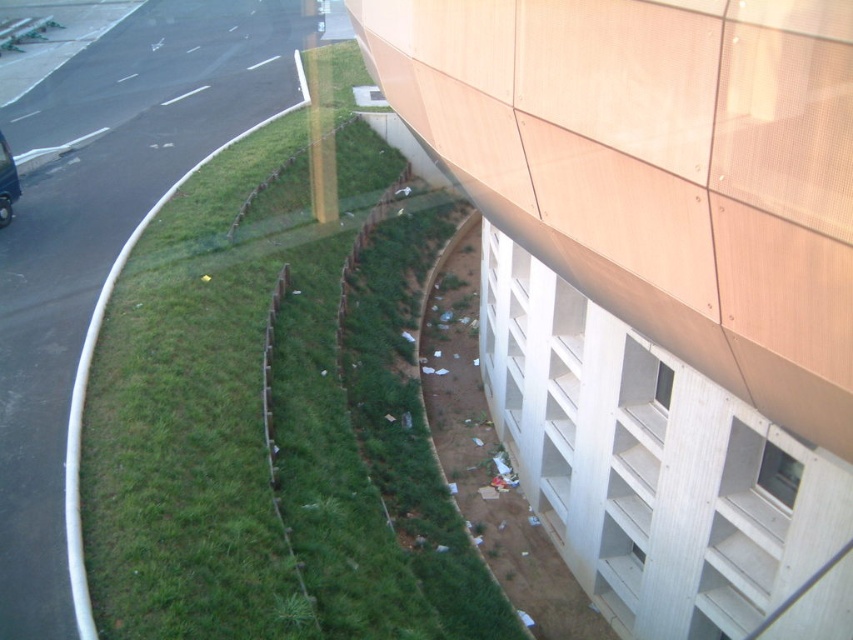
Question: Is green grass at lower left wider than shiny black car at left?

Choices:
 (A) yes
 (B) no

Answer: (A)

Question: Which object is closer to the camera taking this photo?

Choices:
 (A) green grass at lower left
 (B) shiny black car at left

Answer: (A)

Question: Which of the following is the closest to the observer?

Choices:
 (A) (422, 627)
 (B) (0, 132)

Answer: (A)

Question: Which object is farther from the camera taking this photo?

Choices:
 (A) shiny black car at left
 (B) green grass at lower left

Answer: (A)

Question: Does green grass at lower left appear under shiny black car at left?

Choices:
 (A) yes
 (B) no

Answer: (A)

Question: Is green grass at lower left positioned in front of shiny black car at left?

Choices:
 (A) no
 (B) yes

Answer: (B)